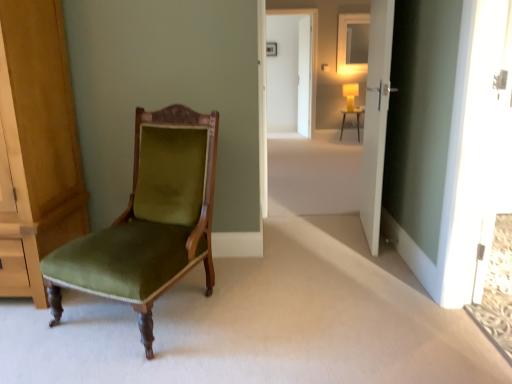
Question: Does matte yellow lampshade at center have a smaller size compared to matte white picture frame at upper center?

Choices:
 (A) no
 (B) yes

Answer: (A)

Question: Is matte yellow lampshade at center positioned beyond the bounds of matte white picture frame at upper center?

Choices:
 (A) yes
 (B) no

Answer: (A)

Question: Considering the relative sizes of matte yellow lampshade at center and matte white picture frame at upper center in the image provided, is matte yellow lampshade at center bigger than matte white picture frame at upper center?

Choices:
 (A) yes
 (B) no

Answer: (A)

Question: Are matte yellow lampshade at center and matte white picture frame at upper center located far from each other?

Choices:
 (A) yes
 (B) no

Answer: (A)

Question: Is matte white picture frame at upper center located within matte yellow lampshade at center?

Choices:
 (A) yes
 (B) no

Answer: (B)

Question: From the image's perspective, is matte yellow lampshade at center below matte white picture frame at upper center?

Choices:
 (A) yes
 (B) no

Answer: (A)

Question: Can you confirm if velvet green chair at left is taller than matte yellow lampshade at center?

Choices:
 (A) no
 (B) yes

Answer: (B)

Question: Could you tell me if velvet green chair at left is facing matte yellow lampshade at center?

Choices:
 (A) no
 (B) yes

Answer: (A)

Question: Can you confirm if velvet green chair at left is smaller than matte yellow lampshade at center?

Choices:
 (A) yes
 (B) no

Answer: (B)

Question: Is the depth of velvet green chair at left less than that of matte yellow lampshade at center?

Choices:
 (A) yes
 (B) no

Answer: (A)

Question: Is velvet green chair at left facing away from matte yellow lampshade at center?

Choices:
 (A) no
 (B) yes

Answer: (B)

Question: Can you confirm if velvet green chair at left is thinner than matte yellow lampshade at center?

Choices:
 (A) no
 (B) yes

Answer: (A)

Question: From a real-world perspective, is matte yellow lampshade at center over matte white desk at center?

Choices:
 (A) no
 (B) yes

Answer: (B)